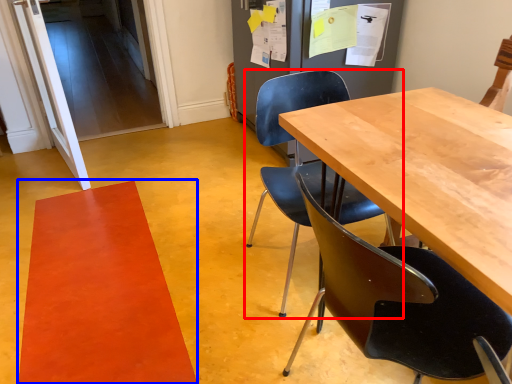
Question: Which object appears closest to the camera in this image, chair (highlighted by a red box) or mat (highlighted by a blue box)?

Choices:
 (A) chair
 (B) mat

Answer: (A)